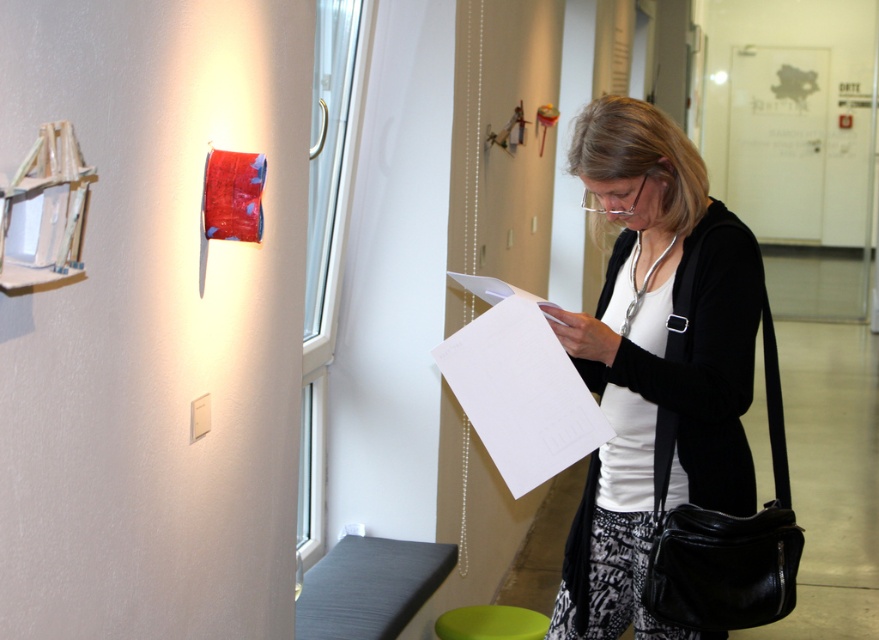
The woman in the scene is holding the white matte paper at center. Where exactly is the white matte paper positioned in relation to her?

The white matte paper at center is located at point (658,364), which places it at the center of the image, so it is directly in front of her as she is standing near the window.

You are standing in the art gallery and want to take a photo of the two points marked in the scene. Which point, point (x=469, y=349) or point (x=525, y=618), is closer to you?

Point (x=469, y=349) is closer to the camera than point (x=525, y=618), so it is closer to you.